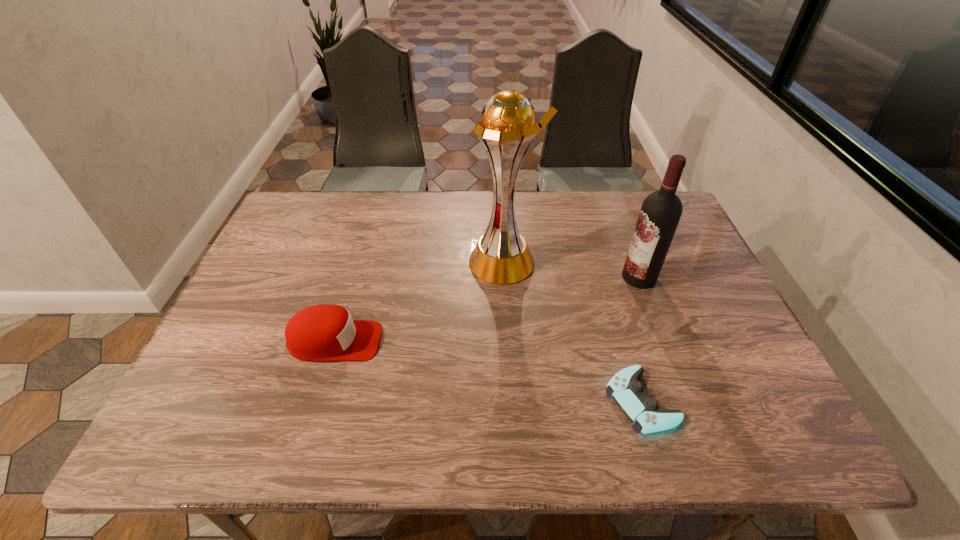
Where is `vacant position in the image that satisfies the following two spatial constraints: 1. on the front-facing side of the second shortest object; 2. on the right side of the control`? The width and height of the screenshot is (960, 540). vacant position in the image that satisfies the following two spatial constraints: 1. on the front-facing side of the second shortest object; 2. on the right side of the control is located at coordinates (317, 401).

This screenshot has height=540, width=960. Identify the location of vacant region that satisfies the following two spatial constraints: 1. on the front-facing side of the nearest object; 2. on the right side of the third farthest object. (317, 401).

At what (x,y) coordinates should I click in order to perform the action: click on vacant point that satisfies the following two spatial constraints: 1. on the front-facing side of the control; 2. on the right side of the tallest object. Please return your answer as a coordinate pair (x, y). The image size is (960, 540). Looking at the image, I should click on (512, 401).

Locate an element on the screen. vacant position in the image that satisfies the following two spatial constraints: 1. on the front-facing side of the third object from right to left; 2. on the right side of the control is located at coordinates (512, 401).

This screenshot has width=960, height=540. In order to click on vacant region that satisfies the following two spatial constraints: 1. on the front-facing side of the shortest object; 2. on the left side of the second nearest object in this screenshot , I will do point(317,401).